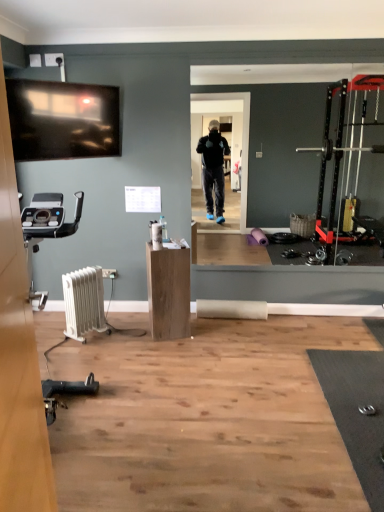
This screenshot has height=512, width=384. In order to click on wooden cabinet at center in this screenshot , I will do `click(168, 292)`.

What do you see at coordinates (168, 292) in the screenshot? The image size is (384, 512). I see `wooden cabinet at center` at bounding box center [168, 292].

Describe the element at coordinates (84, 303) in the screenshot. I see `white plastic radiator at lower left` at that location.

Locate an element on the screen. The width and height of the screenshot is (384, 512). white plastic radiator at lower left is located at coordinates (84, 303).

In order to click on wooden cabinet at center in this screenshot , I will do `click(168, 292)`.

Based on the photo, does wooden cabinet at center appear on the right side of white plastic radiator at lower left?

Indeed, wooden cabinet at center is positioned on the right side of white plastic radiator at lower left.

Which object is closer to the camera taking this photo, wooden cabinet at center or white plastic radiator at lower left?

white plastic radiator at lower left is closer to the camera.

Is point (154, 280) closer to camera compared to point (85, 279)?

Yes, it is in front of point (85, 279).

From the image's perspective, is wooden cabinet at center under white plastic radiator at lower left?

Incorrect, from the image's perspective, wooden cabinet at center is higher than white plastic radiator at lower left.

From a real-world perspective, does wooden cabinet at center sit lower than white plastic radiator at lower left?

No, from a real-world perspective, wooden cabinet at center is not beneath white plastic radiator at lower left.

Does wooden cabinet at center have a lesser width compared to white plastic radiator at lower left?

No.

Considering the sizes of objects wooden cabinet at center and white plastic radiator at lower left in the image provided, who is shorter, wooden cabinet at center or white plastic radiator at lower left?

Standing shorter between the two is white plastic radiator at lower left.

Considering the relative sizes of wooden cabinet at center and white plastic radiator at lower left in the image provided, is wooden cabinet at center bigger than white plastic radiator at lower left?

Yes, wooden cabinet at center is bigger than white plastic radiator at lower left.

Is wooden cabinet at center inside or outside of white plastic radiator at lower left?

wooden cabinet at center is outside white plastic radiator at lower left.

Is the surface of wooden cabinet at center in direct contact with white plastic radiator at lower left?

No, wooden cabinet at center is not in contact with white plastic radiator at lower left.

Looking at this image, does wooden cabinet at center turn towards white plastic radiator at lower left?

No, wooden cabinet at center is not turned towards white plastic radiator at lower left.

How different are the orientations of wooden cabinet at center and white plastic radiator at lower left in degrees?

41.5 degrees separate the facing orientations of wooden cabinet at center and white plastic radiator at lower left.

Find the location of a particular element. The width and height of the screenshot is (384, 512). radiator located in front of the wooden cabinet at center is located at coordinates (84, 303).

Considering the positions of objects white plastic radiator at lower left and wooden cabinet at center in the image provided, who is more to the left, white plastic radiator at lower left or wooden cabinet at center?

white plastic radiator at lower left.

Is white plastic radiator at lower left in front of or behind wooden cabinet at center in the image?

white plastic radiator at lower left is in front of wooden cabinet at center.

Does point (85, 309) come in front of point (157, 298)?

No, it is behind (157, 298).

From the image's perspective, which object appears higher, white plastic radiator at lower left or wooden cabinet at center?

wooden cabinet at center.

From a real-world perspective, which object stands above the other?

wooden cabinet at center is physically above.

Based on the photo, can you confirm if white plastic radiator at lower left is wider than wooden cabinet at center?

No, white plastic radiator at lower left is not wider than wooden cabinet at center.

Is white plastic radiator at lower left taller or shorter than wooden cabinet at center?

In the image, white plastic radiator at lower left appears to be shorter than wooden cabinet at center.

From the picture: Considering the relative sizes of white plastic radiator at lower left and wooden cabinet at center in the image provided, is white plastic radiator at lower left smaller than wooden cabinet at center?

Indeed, white plastic radiator at lower left has a smaller size compared to wooden cabinet at center.

Would you say wooden cabinet at center is part of white plastic radiator at lower left's contents?

That's incorrect, wooden cabinet at center is not inside white plastic radiator at lower left.

Consider the image. Is white plastic radiator at lower left next to wooden cabinet at center and touching it?

No, white plastic radiator at lower left is not with wooden cabinet at center.

Is white plastic radiator at lower left aimed at wooden cabinet at center?

No, white plastic radiator at lower left is not facing towards wooden cabinet at center.

How different are the orientations of white plastic radiator at lower left and wooden cabinet at center in degrees?

There is a 41.5-degree angle between the facing directions of white plastic radiator at lower left and wooden cabinet at center.

Measure the distance from white plastic radiator at lower left to wooden cabinet at center.

white plastic radiator at lower left and wooden cabinet at center are 21.66 inches apart from each other.

Where is `furniture above the white plastic radiator at lower left (from a real-world perspective)`? The width and height of the screenshot is (384, 512). furniture above the white plastic radiator at lower left (from a real-world perspective) is located at coordinates (168, 292).

You are a GUI agent. You are given a task and a screenshot of the screen. Output one action in this format:
    pyautogui.click(x=<x>, y=<y>)
    Task: Click on the furniture behind the white plastic radiator at lower left
    
    Given the screenshot: What is the action you would take?
    pyautogui.click(x=168, y=292)

Image resolution: width=384 pixels, height=512 pixels. I want to click on radiator that appears in front of the wooden cabinet at center, so click(84, 303).